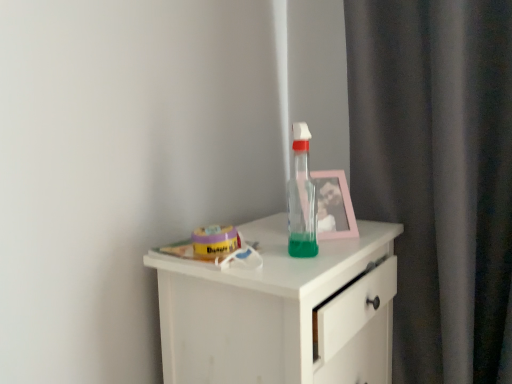
Question: Is white matte chest of drawers at center to the right of pink plastic picture frame at upper right from the viewer's perspective?

Choices:
 (A) yes
 (B) no

Answer: (B)

Question: From a real-world perspective, is white matte chest of drawers at center on top of pink plastic picture frame at upper right?

Choices:
 (A) yes
 (B) no

Answer: (B)

Question: Is pink plastic picture frame at upper right at the back of white matte chest of drawers at center?

Choices:
 (A) no
 (B) yes

Answer: (A)

Question: Is white matte chest of drawers at center behind pink plastic picture frame at upper right?

Choices:
 (A) yes
 (B) no

Answer: (B)

Question: From a real-world perspective, is white matte chest of drawers at center beneath pink plastic picture frame at upper right?

Choices:
 (A) no
 (B) yes

Answer: (B)

Question: Is white matte chest of drawers at center to the left of pink plastic picture frame at upper right from the viewer's perspective?

Choices:
 (A) no
 (B) yes

Answer: (B)

Question: Can you confirm if white matte chest of drawers at center is taller than transparent plastic bottle at center?

Choices:
 (A) no
 (B) yes

Answer: (B)

Question: Does white matte chest of drawers at center have a lesser height compared to transparent plastic bottle at center?

Choices:
 (A) no
 (B) yes

Answer: (A)

Question: Can you confirm if white matte chest of drawers at center is bigger than transparent plastic bottle at center?

Choices:
 (A) no
 (B) yes

Answer: (B)

Question: Is white matte chest of drawers at center at the left side of transparent plastic bottle at center?

Choices:
 (A) no
 (B) yes

Answer: (B)

Question: From a real-world perspective, is white matte chest of drawers at center located beneath transparent plastic bottle at center?

Choices:
 (A) yes
 (B) no

Answer: (A)

Question: Does white matte chest of drawers at center turn towards transparent plastic bottle at center?

Choices:
 (A) no
 (B) yes

Answer: (A)

Question: Is pink plastic picture frame at upper right smaller than transparent plastic bottle at center?

Choices:
 (A) no
 (B) yes

Answer: (A)